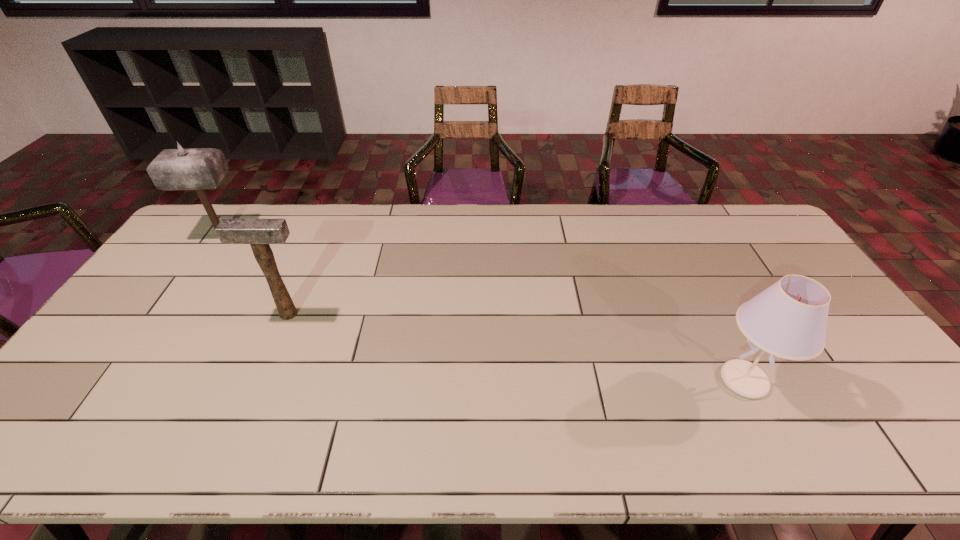
What are the coordinates of `free area in between the second farthest object and the nearest object` in the screenshot? It's located at (516, 347).

Locate an element on the screen. blank region between the lampshade and the nearer mallet is located at coordinates (516, 347).

You are a GUI agent. You are given a task and a screenshot of the screen. Output one action in this format:
    pyautogui.click(x=<x>, y=<y>)
    Task: Click on the free space between the second object from left to right and the farther mallet
    Image resolution: width=960 pixels, height=540 pixels.
    Given the screenshot: What is the action you would take?
    pyautogui.click(x=255, y=275)

At what (x,y) coordinates should I click in order to perform the action: click on vacant point located between the rightmost object and the nearer mallet. Please return your answer as a coordinate pair (x, y). This screenshot has height=540, width=960. Looking at the image, I should click on (516, 347).

The height and width of the screenshot is (540, 960). Identify the location of free space between the leftmost object and the nearest object. (483, 308).

At what (x,y) coordinates should I click in order to perform the action: click on free space between the leftmost object and the second object from left to right. Please return your answer as a coordinate pair (x, y). This screenshot has height=540, width=960. Looking at the image, I should click on (255, 275).

Find the location of a particular element. The image size is (960, 540). empty space that is in between the farther mallet and the nearer mallet is located at coordinates (255, 275).

Identify which object is located as the nearest to the right mallet. Please provide its 2D coordinates. Your answer should be formatted as a tuple, i.e. [(x, y)], where the tuple contains the x and y coordinates of a point satisfying the conditions above.

[(198, 169)]

Select which object appears as the second closest to the farthest object. Please provide its 2D coordinates. Your answer should be formatted as a tuple, i.e. [(x, y)], where the tuple contains the x and y coordinates of a point satisfying the conditions above.

[(788, 320)]

Identify the location of vacant area that satisfies the following two spatial constraints: 1. on the front side of the lampshade; 2. on the right side of the right mallet. This screenshot has width=960, height=540. (260, 380).